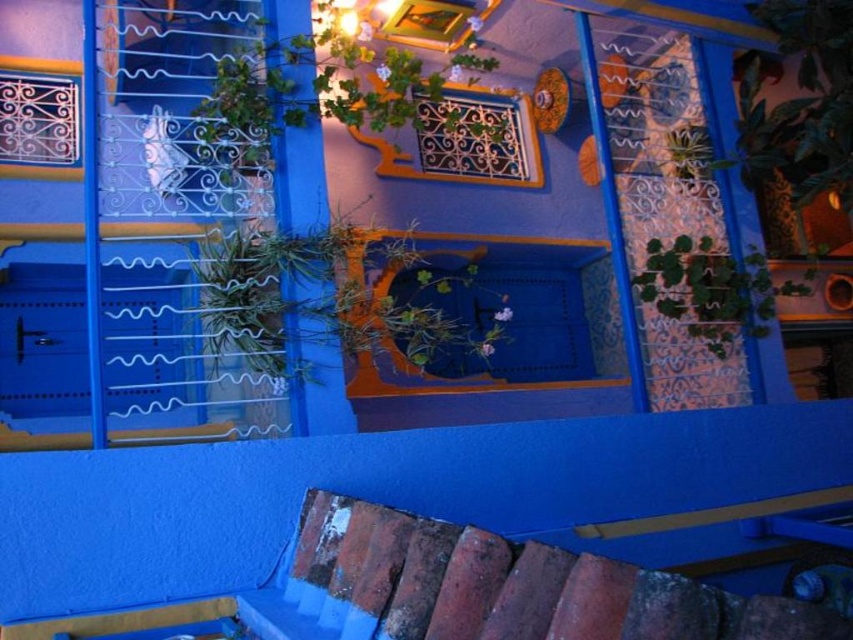
Is green leafy plant at upper center in front of green matte plant at upper right?

Yes.

Between point (257, 44) and point (705, 250), which one is positioned behind?

Positioned behind is point (705, 250).

Image resolution: width=853 pixels, height=640 pixels. Find the location of `green leafy plant at upper center`. green leafy plant at upper center is located at coordinates (325, 83).

Can you confirm if green leafy plant at center is wider than green matte plant at upper right?

Yes, green leafy plant at center is wider than green matte plant at upper right.

Can you confirm if green leafy plant at center is positioned to the left of green matte plant at upper right?

Yes, green leafy plant at center is to the left of green matte plant at upper right.

Does point (354, 292) come in front of point (675, 243)?

Yes.

Find the location of `green leafy plant at center`. green leafy plant at center is located at coordinates (325, 296).

Between green matte plant at upper right and green leafy plant at upper right, which one appears on the right side from the viewer's perspective?

green matte plant at upper right is more to the right.

Which of these two, green matte plant at upper right or green leafy plant at upper right, stands taller?

green matte plant at upper right is taller.

Describe the element at coordinates (712, 289) in the screenshot. I see `green matte plant at upper right` at that location.

Locate an element on the screen. green matte plant at upper right is located at coordinates (712, 289).